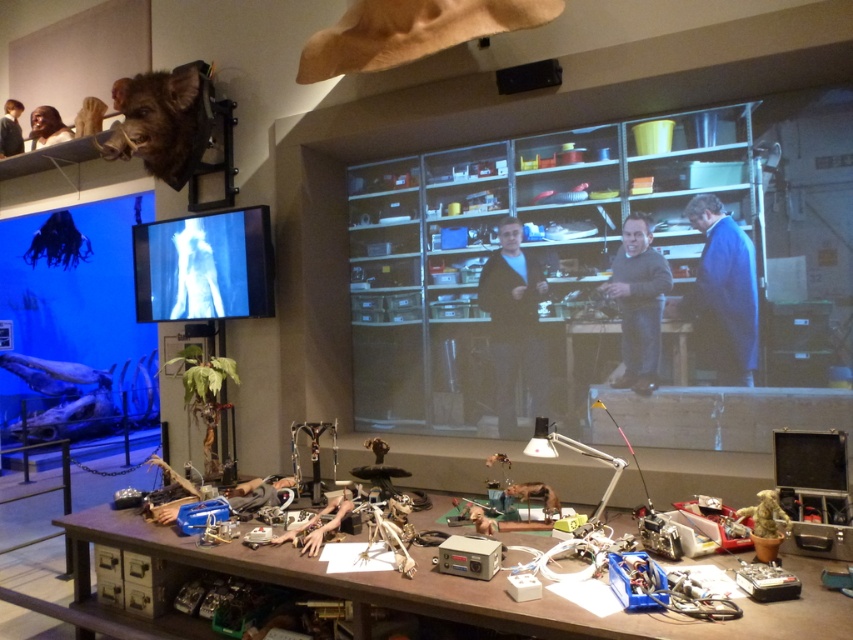
Question: Can you confirm if wooden table at center is thinner than matte black screen at center?

Choices:
 (A) yes
 (B) no

Answer: (B)

Question: Does wooden table at center have a lesser width compared to matte black screen at center?

Choices:
 (A) yes
 (B) no

Answer: (B)

Question: Which object appears closest to the camera in this image?

Choices:
 (A) matte black screen at center
 (B) wooden table at center

Answer: (B)

Question: Does wooden table at center have a larger size compared to matte black screen at center?

Choices:
 (A) no
 (B) yes

Answer: (B)

Question: Which of the following is the closest to the observer?

Choices:
 (A) matte black screen at center
 (B) wooden table at center

Answer: (B)

Question: Which object appears closest to the camera in this image?

Choices:
 (A) wooden table at center
 (B) matte black screen at center

Answer: (A)